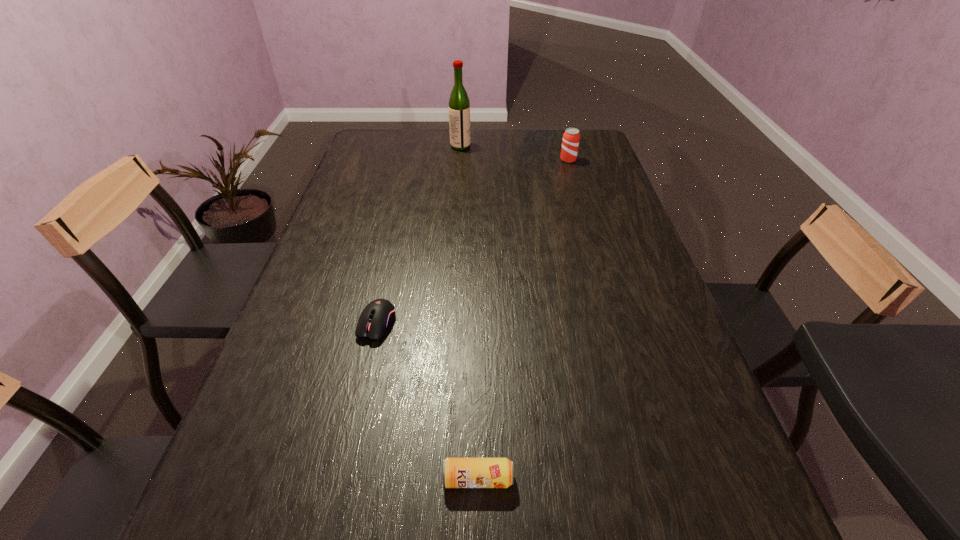
This screenshot has width=960, height=540. In order to click on free space between the shorter beer can and the tallest object in this screenshot , I will do `click(469, 313)`.

Where is `object that is the closest to the nearer beer can`? The image size is (960, 540). object that is the closest to the nearer beer can is located at coordinates (379, 315).

Choose which object is the nearest neighbor to the third nearest object. Please provide its 2D coordinates. Your answer should be formatted as a tuple, i.e. [(x, y)], where the tuple contains the x and y coordinates of a point satisfying the conditions above.

[(459, 105)]

Identify the location of free spot that satisfies the following two spatial constraints: 1. on the label of the farthest object; 2. on the back side of the taller beer can. The image size is (960, 540). (460, 160).

Image resolution: width=960 pixels, height=540 pixels. Find the location of `vacant area that satisfies the following two spatial constraints: 1. on the label of the left beer can; 2. on the right side of the tallest object`. vacant area that satisfies the following two spatial constraints: 1. on the label of the left beer can; 2. on the right side of the tallest object is located at coordinates (438, 478).

Where is `free spot that satisfies the following two spatial constraints: 1. on the label of the tallest object; 2. on the back side of the farther beer can`? The height and width of the screenshot is (540, 960). free spot that satisfies the following two spatial constraints: 1. on the label of the tallest object; 2. on the back side of the farther beer can is located at coordinates (460, 160).

Where is `vacant region that satisfies the following two spatial constraints: 1. on the label of the nearer beer can; 2. on the left side of the tallest object`? vacant region that satisfies the following two spatial constraints: 1. on the label of the nearer beer can; 2. on the left side of the tallest object is located at coordinates (438, 478).

I want to click on free space that satisfies the following two spatial constraints: 1. on the label of the tallest object; 2. on the right side of the shorter beer can, so click(x=438, y=478).

Where is `vacant space that satisfies the following two spatial constraints: 1. on the label of the farthest object; 2. on the right side of the rightmost object`? Image resolution: width=960 pixels, height=540 pixels. vacant space that satisfies the following two spatial constraints: 1. on the label of the farthest object; 2. on the right side of the rightmost object is located at coordinates (460, 160).

The width and height of the screenshot is (960, 540). Find the location of `vacant space that satisfies the following two spatial constraints: 1. on the back side of the left beer can; 2. on the label of the farthest object`. vacant space that satisfies the following two spatial constraints: 1. on the back side of the left beer can; 2. on the label of the farthest object is located at coordinates [479, 146].